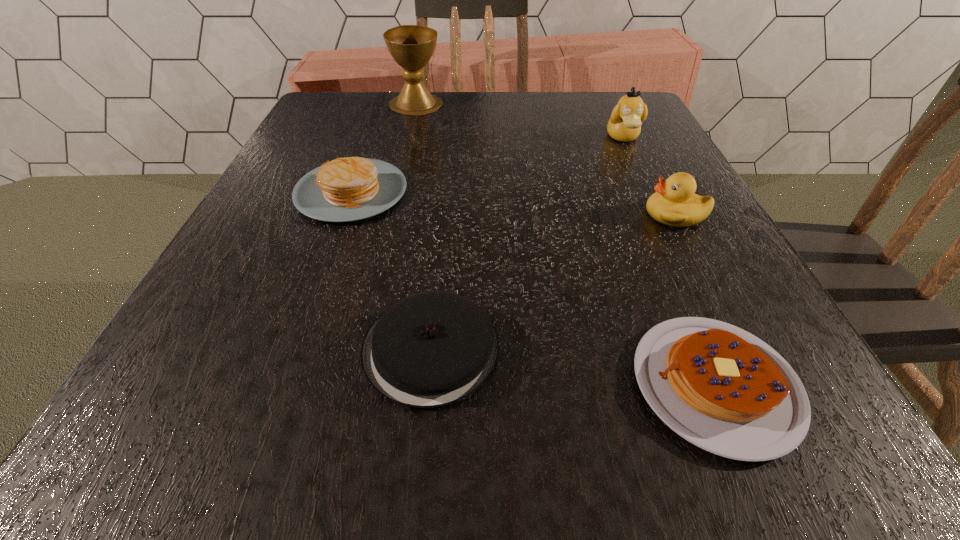
The image size is (960, 540). In order to click on vacant space situated 0.320m on the face of the fifth shortest object in this screenshot , I will do `click(675, 247)`.

The image size is (960, 540). What are the coordinates of `free space located at the face of the shorter duckling` in the screenshot? It's located at (462, 214).

Find the location of a particular element. This screenshot has width=960, height=540. vacant space situated at the face of the shorter duckling is located at coordinates (618, 214).

Locate an element on the screen. free space located at the face of the shorter duckling is located at coordinates (439, 214).

Where is `vacant area situated 0.100m on the back of the farthest pancake`? This screenshot has width=960, height=540. vacant area situated 0.100m on the back of the farthest pancake is located at coordinates (371, 139).

Image resolution: width=960 pixels, height=540 pixels. I want to click on vacant space located on the left of the rightmost pancake, so click(x=383, y=384).

This screenshot has height=540, width=960. In order to click on chalice positioned at the far edge in this screenshot , I will do `click(411, 46)`.

Where is `duckling at the far edge`? This screenshot has width=960, height=540. duckling at the far edge is located at coordinates (626, 119).

You are a GUI agent. You are given a task and a screenshot of the screen. Output one action in this format:
    pyautogui.click(x=<x>, y=<y>)
    Task: Click on the object situated at the left edge
    This screenshot has width=960, height=540.
    Given the screenshot: What is the action you would take?
    pyautogui.click(x=347, y=189)

This screenshot has width=960, height=540. What are the coordinates of `pancake at the right edge` in the screenshot? It's located at (721, 388).